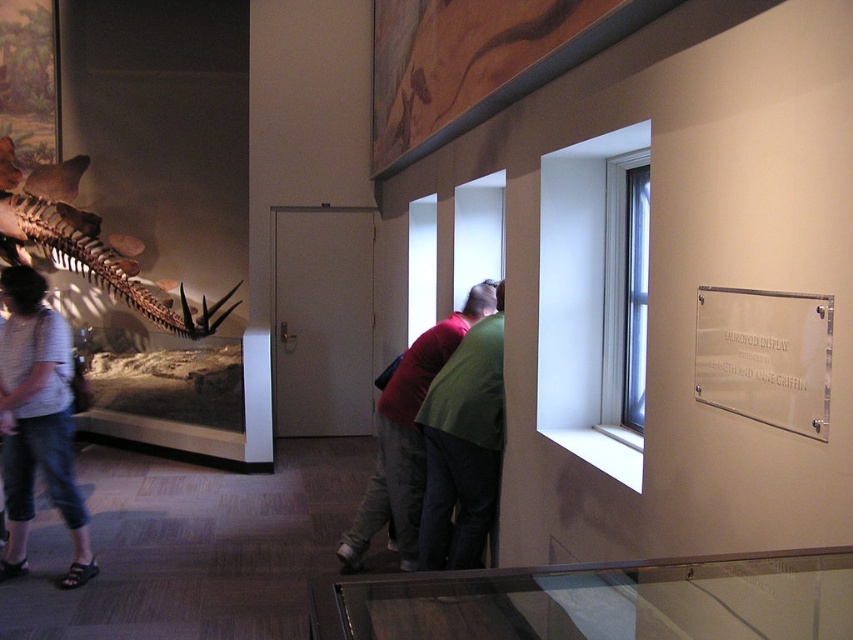
Which is above, denim shorts at lower left or green fabric shirt at center?

denim shorts at lower left is higher up.

Can you confirm if denim shorts at lower left is bigger than green fabric shirt at center?

No.

What do you see at coordinates (38, 420) in the screenshot?
I see `denim shorts at lower left` at bounding box center [38, 420].

At what (x,y) coordinates should I click in order to perform the action: click on denim shorts at lower left. Please return your answer as a coordinate pair (x, y). Looking at the image, I should click on [x=38, y=420].

Does point (59, 170) lie behind point (451, 332)?

Yes, it is.

Does matte brown skeleton at left have a lesser width compared to green fabric shirt at center?

No, matte brown skeleton at left is not thinner than green fabric shirt at center.

Where is `matte brown skeleton at left`? matte brown skeleton at left is located at coordinates (84, 243).

Who is lower down, denim shorts at lower left or matte brown skeleton at left?

denim shorts at lower left is below.

Identify the location of denim shorts at lower left. (38, 420).